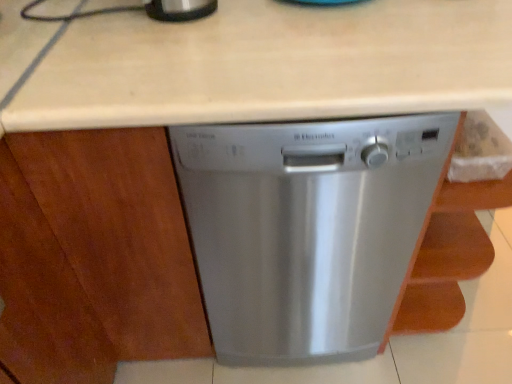
I want to click on vacant space situated above satin silver dishwasher at center (from a real-world perspective), so click(x=301, y=35).